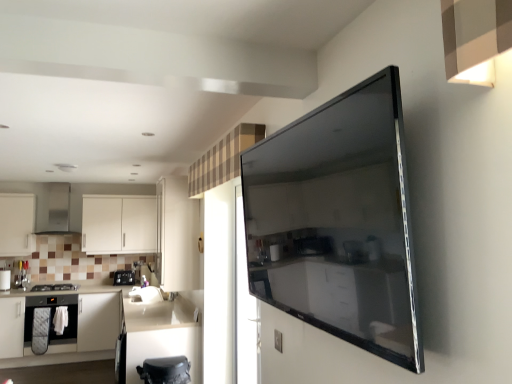
Question: Is black plastic toaster at left situated inside brushed metal knife block at left, which is counted as the 3th appliance, starting from the front, or outside?

Choices:
 (A) outside
 (B) inside

Answer: (A)

Question: In terms of size, does black plastic toaster at left appear bigger or smaller than brushed metal knife block at left, which is counted as the 3th appliance, starting from the front?

Choices:
 (A) big
 (B) small

Answer: (A)

Question: Which is nearer to the black plastic toaster at left?

Choices:
 (A) brushed metal knife block at left, marked as the 2th appliance in a left-to-right arrangement
 (B) white glossy sink at lower center
 (C) white matte cabinetry at left, which ranks as the sixth cabinetry in back-to-front order
 (D) black glass stove at left, which ranks as the 2th appliance in front-to-back order
 (E) white matte cabinet at lower left, the fourth cabinetry when ordered from front to back

Answer: (B)

Question: Which is farther from the white glossy cabinet at lower center, which ranks as the second cabinetry in front-to-back order?

Choices:
 (A) white plastic electric outlet at upper center
 (B) stainless steel exhaust hood at left
 (C) black matte toaster at lower center, the first appliance from the front
 (D) white matte cabinet at left, positioned as the second cabinetry in back-to-front order
 (E) white glossy sink at lower center

Answer: (D)